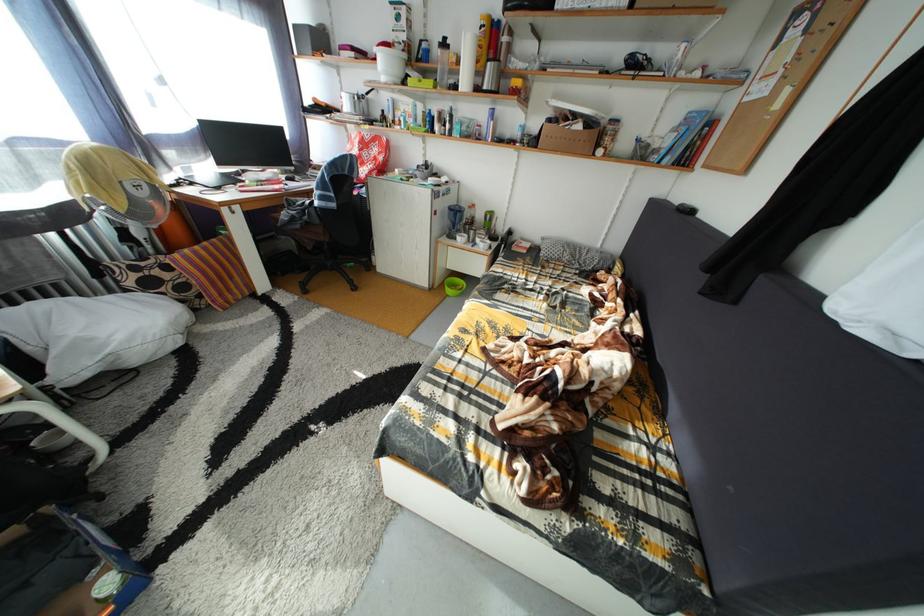
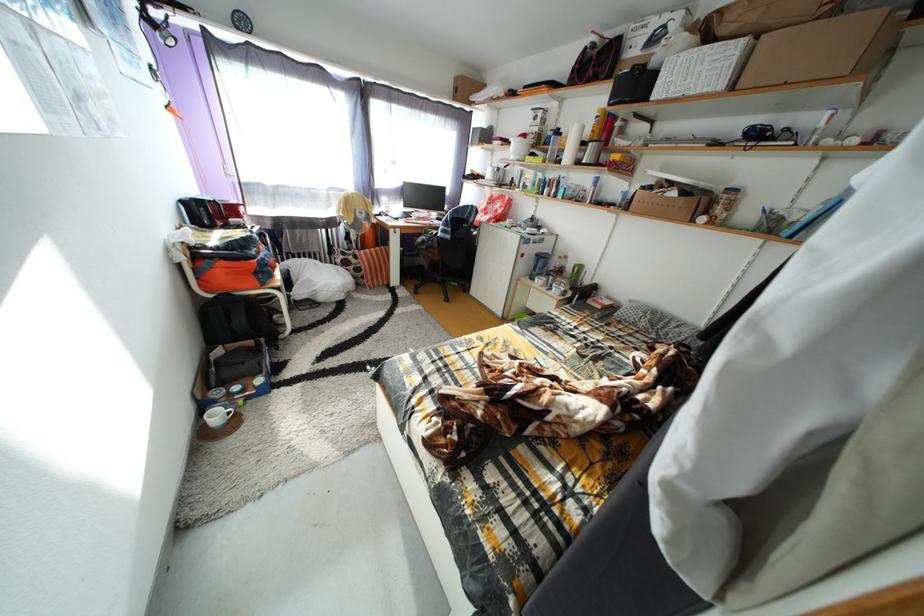
Where in the second image is the point corresponding to pixel 489 54 from the first image?

(602, 138)